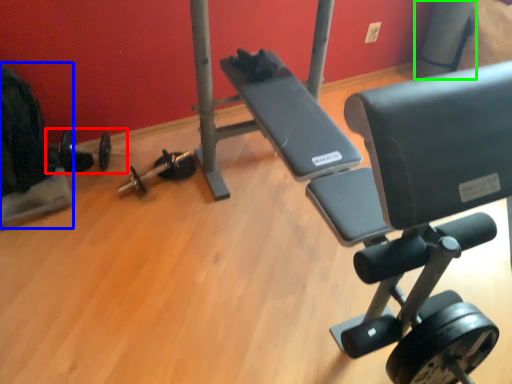
Question: Considering the real-world distances, which object is farthest from barbell (highlighted by a red box)? swivel chair (highlighted by a blue box) or pole (highlighted by a green box)?

Choices:
 (A) swivel chair
 (B) pole

Answer: (B)